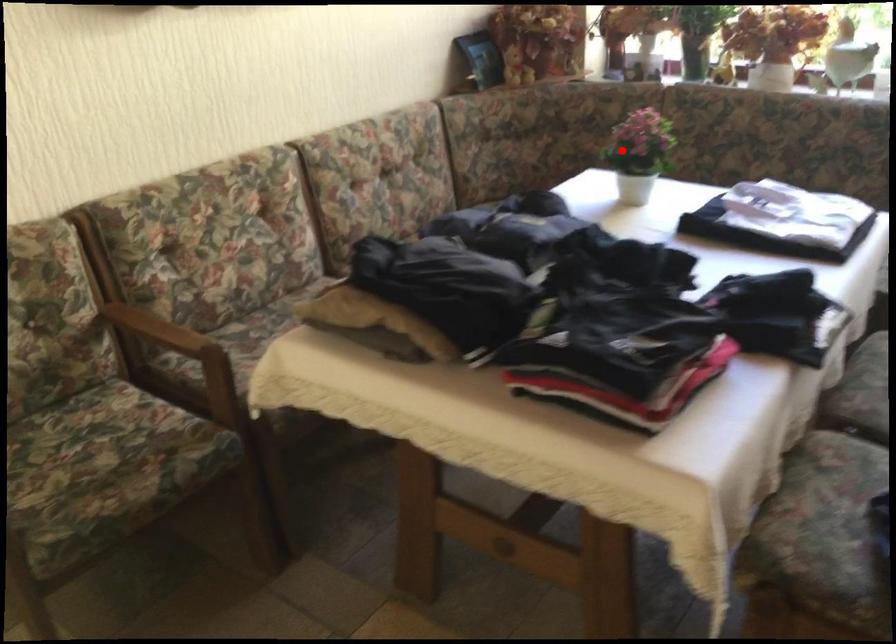
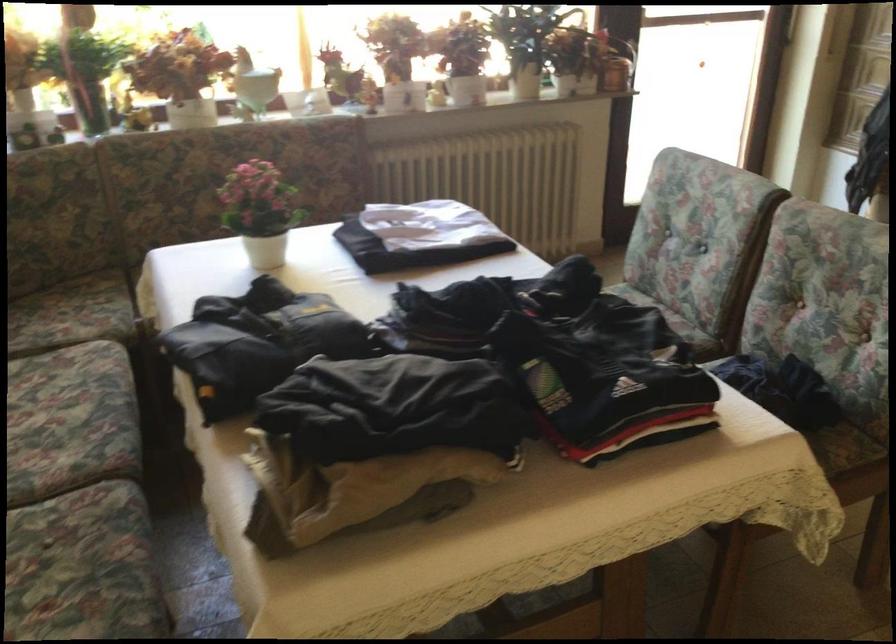
Question: I am providing you with two images of the same scene from different viewpoints. In image1, a red point is highlighted. Considering the same 3D point in image2, which of the following is correct?

Choices:
 (A) It is closer
 (B) It is farther

Answer: (A)